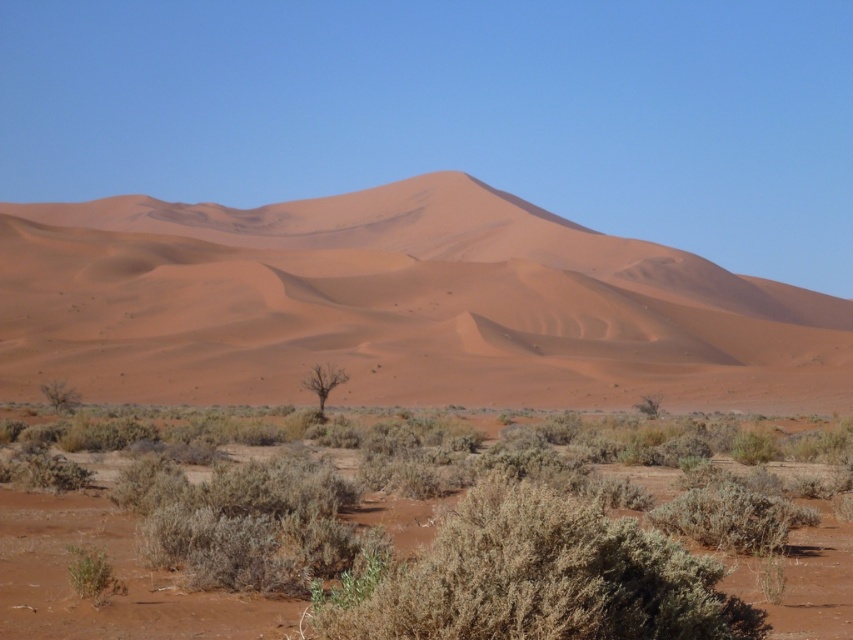
You are standing in the desert scene and see a point marked at coordinates (x=543, y=579). What object does this point correspond to?

The point at coordinates (x=543, y=579) corresponds to the green shrub at center.